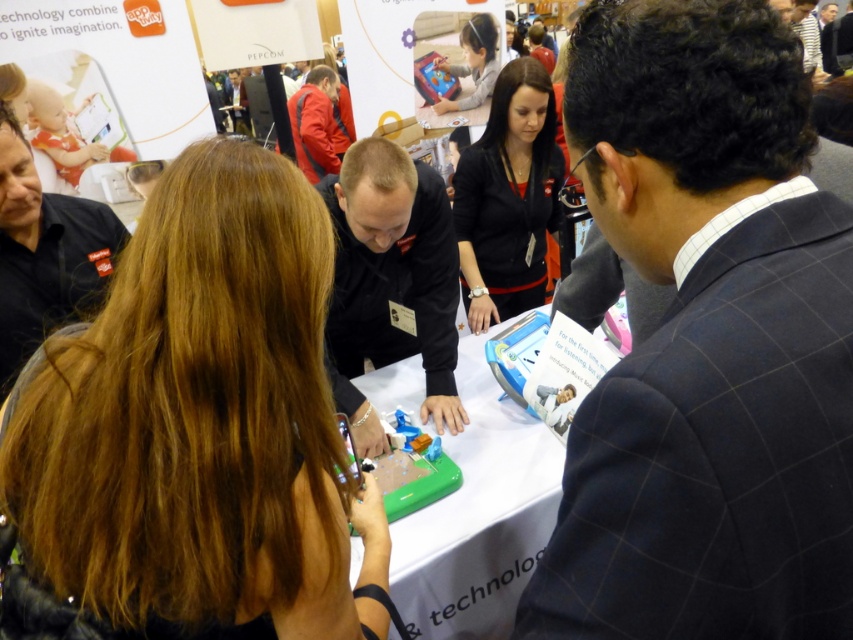
You are attending an event and want to take a photo of both the brown hair at center and the black matte shirt at center. Which object should you focus on first if you want to ensure both are in the frame?

The brown hair at center is wider than the black matte shirt at center, so you should focus on the brown hair at center first to ensure both fit in the frame.

You are at the event and want to take a photo of both the black matte shirt at center and the black matte shirt at left. Which one is closer to the camera?

The black matte shirt at center is positioned under the black matte shirt at left, so the black matte shirt at left is closer to the camera.